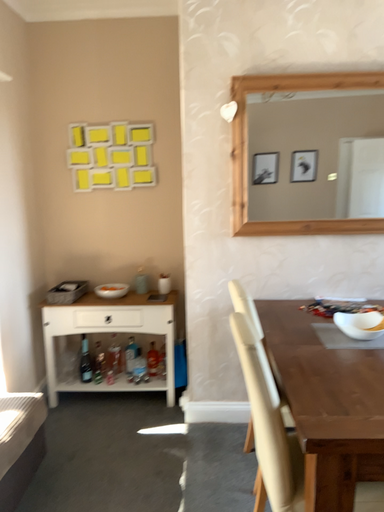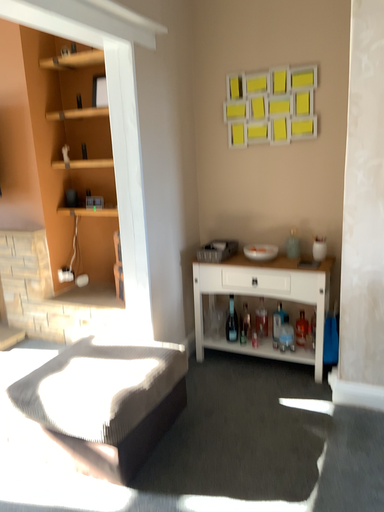
Question: How did the camera likely rotate when shooting the video?

Choices:
 (A) rotated left
 (B) rotated right

Answer: (A)